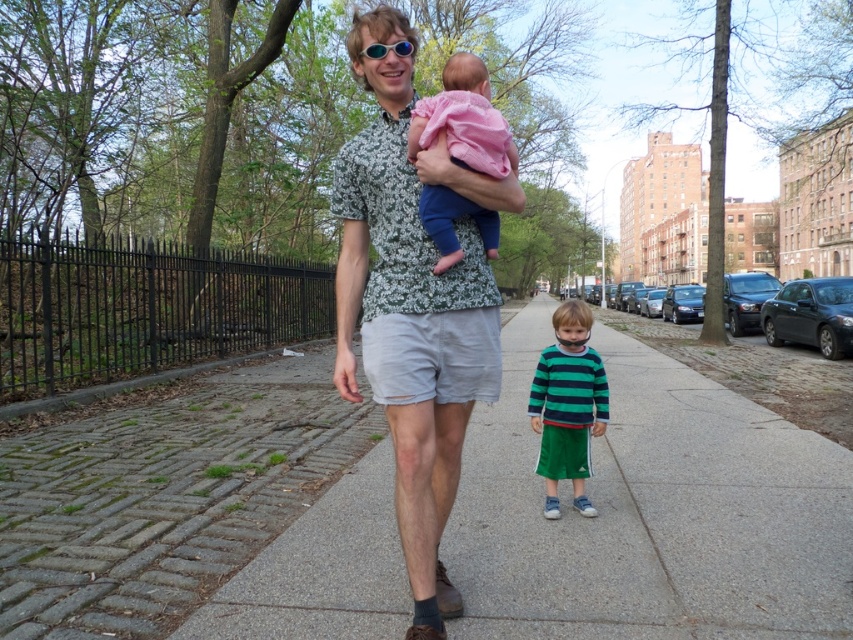
Who is lower down, gray concrete sidewalk at center or floral-patterned shirt at center?

gray concrete sidewalk at center is below.

Is point (641, 531) positioned after point (387, 60)?

Yes, point (641, 531) is farther from viewer.

What do you see at coordinates (651, 513) in the screenshot? This screenshot has width=853, height=640. I see `gray concrete sidewalk at center` at bounding box center [651, 513].

Identify the location of gray concrete sidewalk at center. (651, 513).

Between pink soft fabric baby at center and sunglasses at center, which one has more height?

pink soft fabric baby at center is taller.

How much distance is there between pink soft fabric baby at center and sunglasses at center?

The distance of pink soft fabric baby at center from sunglasses at center is 11.58 inches.

In order to click on pink soft fabric baby at center in this screenshot , I will do `click(463, 120)`.

Is pink soft fabric baby at center positioned behind green striped shirt at center?

That is False.

Who is shorter, pink soft fabric baby at center or green striped shirt at center?

With less height is pink soft fabric baby at center.

Where is `pink soft fabric baby at center`? The width and height of the screenshot is (853, 640). pink soft fabric baby at center is located at coordinates (463, 120).